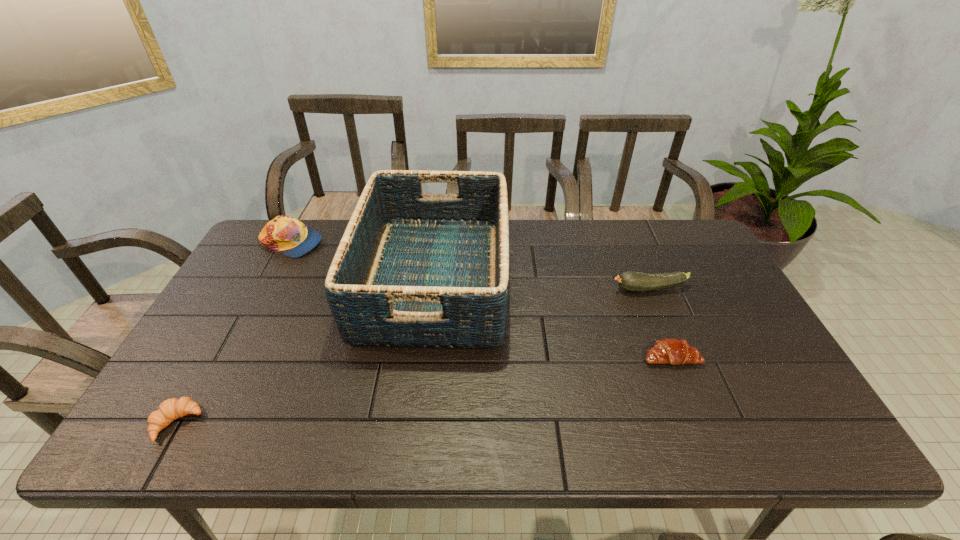
This screenshot has height=540, width=960. In order to click on vacant space located at the blossom end of the third tallest object in this screenshot , I will do `click(577, 289)`.

At what (x,y) coordinates should I click in order to perform the action: click on vacant area situated at the blossom end of the third tallest object. Please return your answer as a coordinate pair (x, y). This screenshot has width=960, height=540. Looking at the image, I should click on (534, 289).

Identify the location of free space located 0.390m on the back of the right crescent roll. This screenshot has width=960, height=540. (629, 253).

Locate an element on the screen. The width and height of the screenshot is (960, 540). vacant space located 0.300m on the right of the nearer crescent roll is located at coordinates (332, 423).

Identify the location of basket that is at the far edge. (413, 269).

Locate an element on the screen. The image size is (960, 540). cap present at the far edge is located at coordinates (287, 235).

Image resolution: width=960 pixels, height=540 pixels. Identify the location of object present at the near edge. (169, 410).

Locate an element on the screen. The image size is (960, 540). cap present at the left edge is located at coordinates (287, 235).

I want to click on crescent roll present at the left edge, so click(x=169, y=410).

I want to click on object located in the right edge section of the desktop, so tap(631, 281).